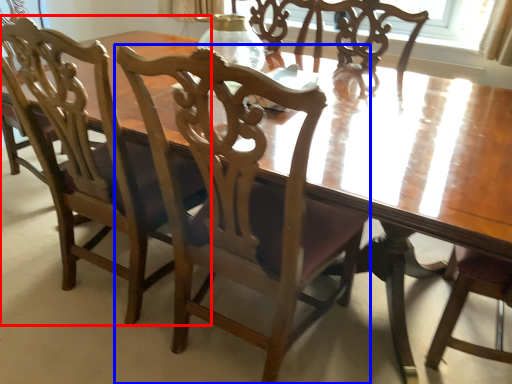
Question: Among these objects, which one is nearest to the camera, chair (highlighted by a red box) or chair (highlighted by a blue box)?

Choices:
 (A) chair
 (B) chair

Answer: (B)